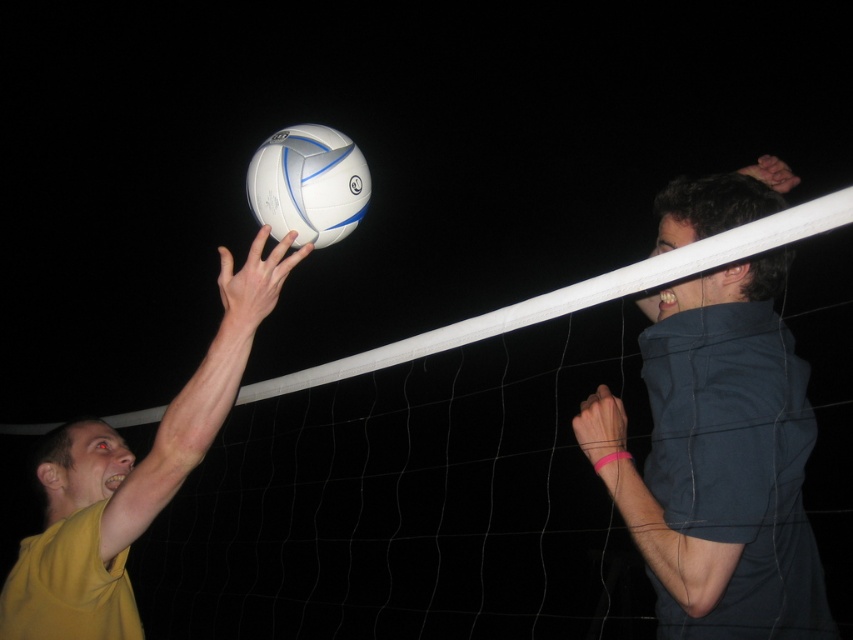
Between dark blue shirt at upper right and white matte/vinyl volleyball at upper center, which one has less height?

With less height is white matte/vinyl volleyball at upper center.

Is point (665, 189) less distant than point (300, 188)?

No, it is behind (300, 188).

Image resolution: width=853 pixels, height=640 pixels. Find the location of `dark blue shirt at upper right`. dark blue shirt at upper right is located at coordinates (718, 460).

Is yellow matte shirt at upper left smaller than white matte/vinyl volleyball at upper center?

Incorrect, yellow matte shirt at upper left is not smaller in size than white matte/vinyl volleyball at upper center.

Is yellow matte shirt at upper left below white matte/vinyl volleyball at upper center?

Correct, yellow matte shirt at upper left is located below white matte/vinyl volleyball at upper center.

The height and width of the screenshot is (640, 853). In order to click on yellow matte shirt at upper left in this screenshot , I will do `click(131, 476)`.

What are the coordinates of `yellow matte shirt at upper left` in the screenshot? It's located at (131, 476).

Is dark blue shirt at upper right shorter than yellow matte shirt at upper left?

In fact, dark blue shirt at upper right may be taller than yellow matte shirt at upper left.

Between point (648, 310) and point (199, 413), which one is positioned in front?

Positioned in front is point (199, 413).

Identify the location of dark blue shirt at upper right. (718, 460).